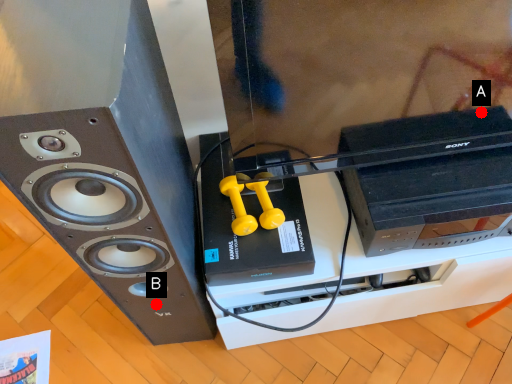
Question: Two points are circled on the image, labeled by A and B beside each circle. Which point is farther to the camera?

Choices:
 (A) A is further
 (B) B is further

Answer: (B)